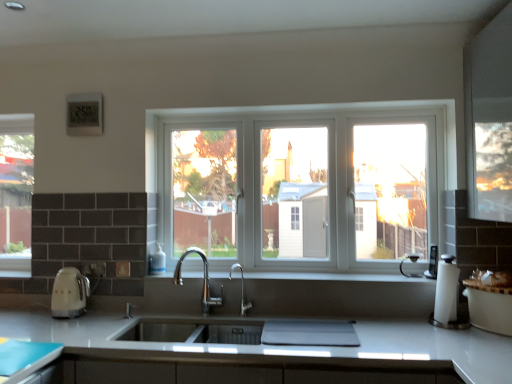
Question: From a real-world perspective, relative to matte cream kettle at left, arranged as the 2th appliance when viewed from the right, is white glossy countertop at center vertically above or below?

Choices:
 (A) above
 (B) below

Answer: (B)

Question: Is white glossy countertop at center bigger or smaller than matte cream kettle at left, arranged as the 2th appliance when viewed from the right?

Choices:
 (A) small
 (B) big

Answer: (B)

Question: Based on their relative distances, which object is farther from the white plastic phone at right, which ranks as the 1th appliance in right-to-left order?

Choices:
 (A) white plastic window at center, the 2th window from the left
 (B) clear glass window at left, the second window viewed from the right
 (C) polished chrome faucet at center
 (D) white glossy countertop at center
 (E) white glossy coffee machine at right

Answer: (B)

Question: Considering the real-world distances, which object is closest to the white glossy coffee machine at right?

Choices:
 (A) matte white countertop at lower left
 (B) clear glass window at left, which is the first window from back to front
 (C) white plastic phone at right, the 2th appliance in the left-to-right sequence
 (D) matte cream kettle at left, arranged as the 2th appliance when viewed from the right
 (E) white glossy countertop at center

Answer: (E)